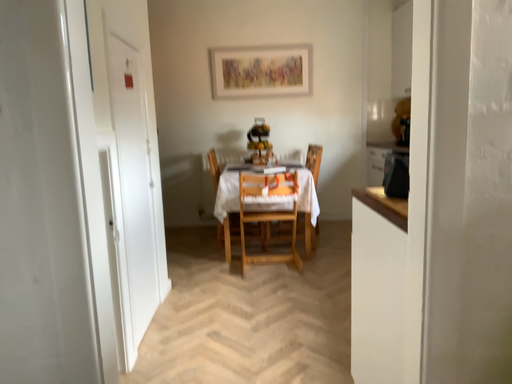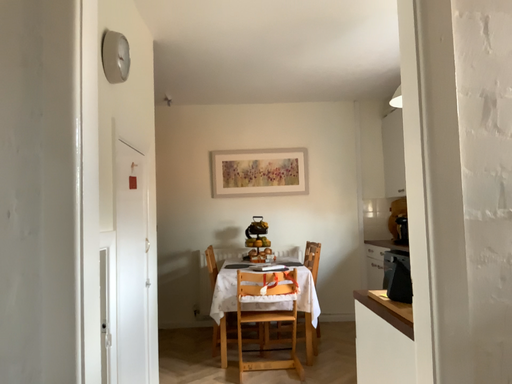
Question: How did the camera likely rotate when shooting the video?

Choices:
 (A) rotated downward
 (B) rotated upward

Answer: (B)